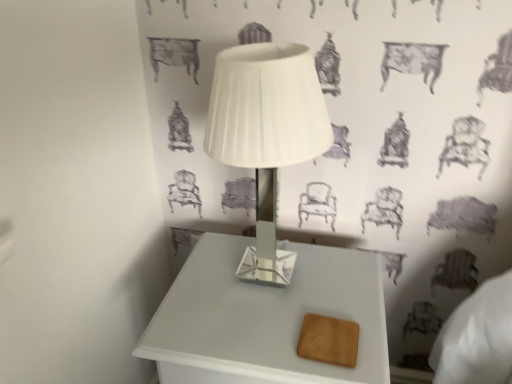
The width and height of the screenshot is (512, 384). I want to click on vacant space in front of white glossy lamp at center, so tap(274, 340).